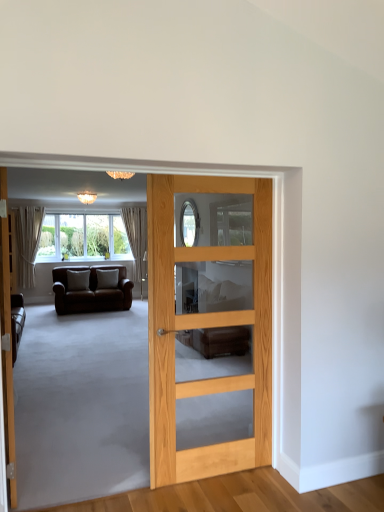
Identify the location of free space that is to the left of natural wood door at center. (121, 472).